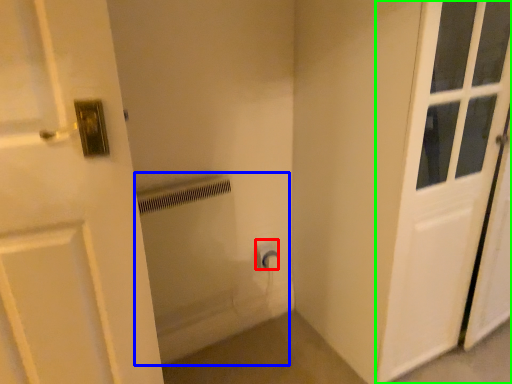
Question: Which object is positioned closest to electric outlet (highlighted by a red box)? Select from bath (highlighted by a blue box) and door (highlighted by a green box).

Choices:
 (A) bath
 (B) door

Answer: (A)